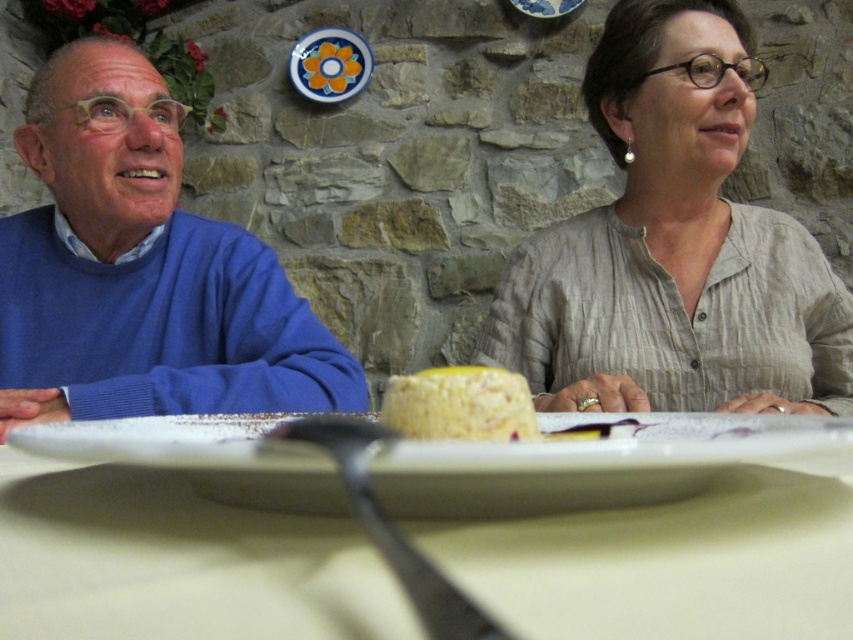
Question: Which of the following is the closest to the observer?

Choices:
 (A) white matte plate at center
 (B) porcelain plate at upper center
 (C) matte blue sweater at left

Answer: (A)

Question: Considering the real-world distances, which object is farthest from the blue glazed plate at upper center?

Choices:
 (A) yellow sponge cake at center
 (B) light beige linen blouse at upper right
 (C) white matte plate at center

Answer: (C)

Question: Considering the real-world distances, which object is closest to the white glossy plate at center?

Choices:
 (A) blue glazed plate at upper center
 (B) yellow sponge cake at center
 (C) matte blue sweater at left
 (D) white matte plate at center

Answer: (D)

Question: In this image, where is white matte plate at center located relative to white glossy plate at center?

Choices:
 (A) right
 (B) left

Answer: (A)

Question: Can you confirm if matte blue sweater at left is thinner than light beige linen blouse at upper right?

Choices:
 (A) yes
 (B) no

Answer: (B)

Question: Is the position of light beige linen blouse at upper right more distant than that of white glossy plate at center?

Choices:
 (A) no
 (B) yes

Answer: (B)